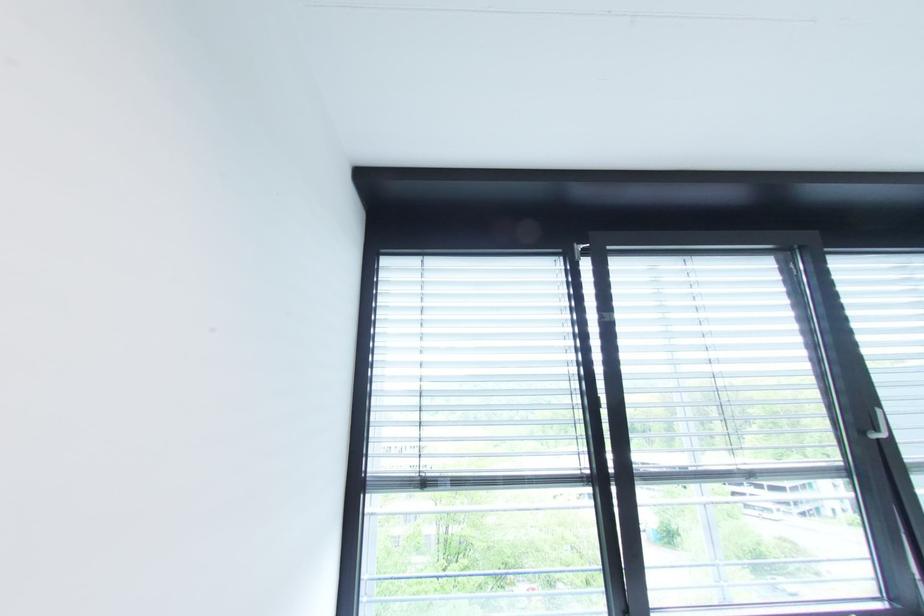
This screenshot has height=616, width=924. In order to click on white window handle in this screenshot , I will do `click(879, 426)`.